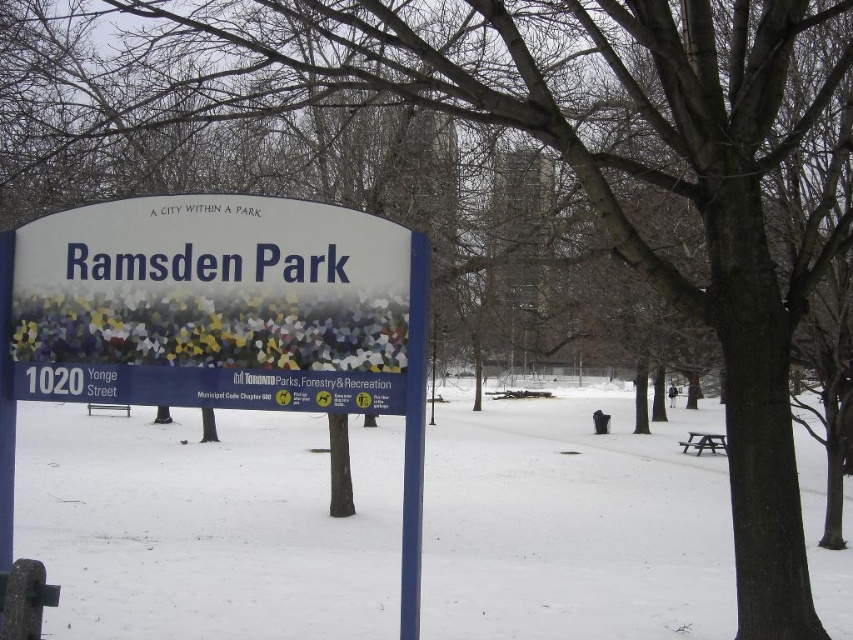
Between point (285, 435) and point (315, 403), which one is positioned in front?

Point (315, 403) is in front.

Which is more to the left, white powdery snow at center or blue plastic sign at center?

Positioned to the left is white powdery snow at center.

This screenshot has width=853, height=640. What do you see at coordinates (206, 525) in the screenshot? I see `white powdery snow at center` at bounding box center [206, 525].

Locate an element on the screen. The image size is (853, 640). white powdery snow at center is located at coordinates (206, 525).

Between point (33, 291) and point (247, 257), which one is positioned in front?

Positioned in front is point (247, 257).

Can you confirm if blue plastic sign at center is positioned below white plastic sign at center?

Indeed, blue plastic sign at center is positioned under white plastic sign at center.

Locate an element on the screen. The height and width of the screenshot is (640, 853). blue plastic sign at center is located at coordinates (219, 321).

Based on the photo, can you confirm if white powdery snow at center is positioned below white plastic sign at center?

Yes.

Find the location of a particular element. The height and width of the screenshot is (640, 853). white powdery snow at center is located at coordinates (206, 525).

Where is `white powdery snow at center`? This screenshot has height=640, width=853. white powdery snow at center is located at coordinates (206, 525).